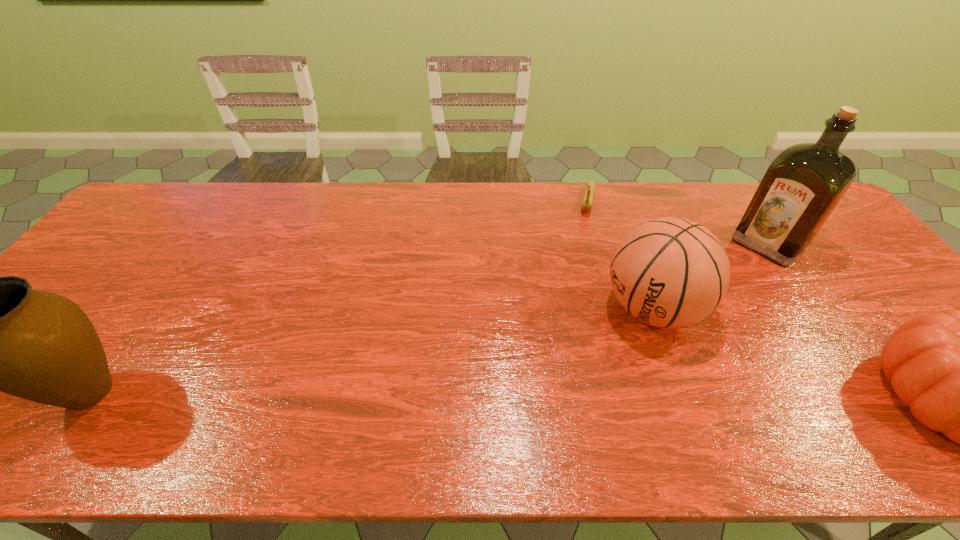
Locate an element on the screen. free space on the desktop that is between the urn and the pumpkin and is positioned on the surface of the basketball near the brand logo is located at coordinates (527, 396).

Locate an element on the screen. Image resolution: width=960 pixels, height=540 pixels. free space on the desktop that is between the leftmost object and the pumpkin and is positioned at the stem of the shortest object is located at coordinates click(543, 397).

Where is `free spot on the desktop that is between the leftmost object and the second shortest object and is positioned on the label of the liquor`? This screenshot has width=960, height=540. free spot on the desktop that is between the leftmost object and the second shortest object and is positioned on the label of the liquor is located at coordinates (603, 397).